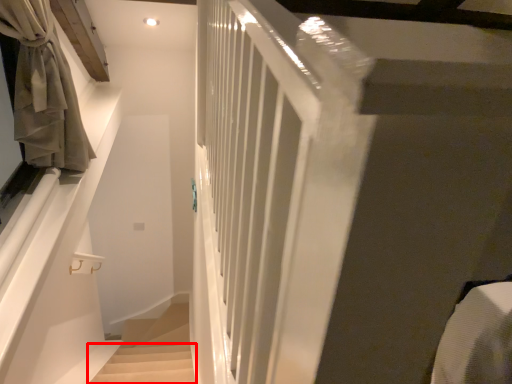
Question: In this image, where is stairs (annotated by the red box) located relative to curtain?

Choices:
 (A) left
 (B) right

Answer: (B)